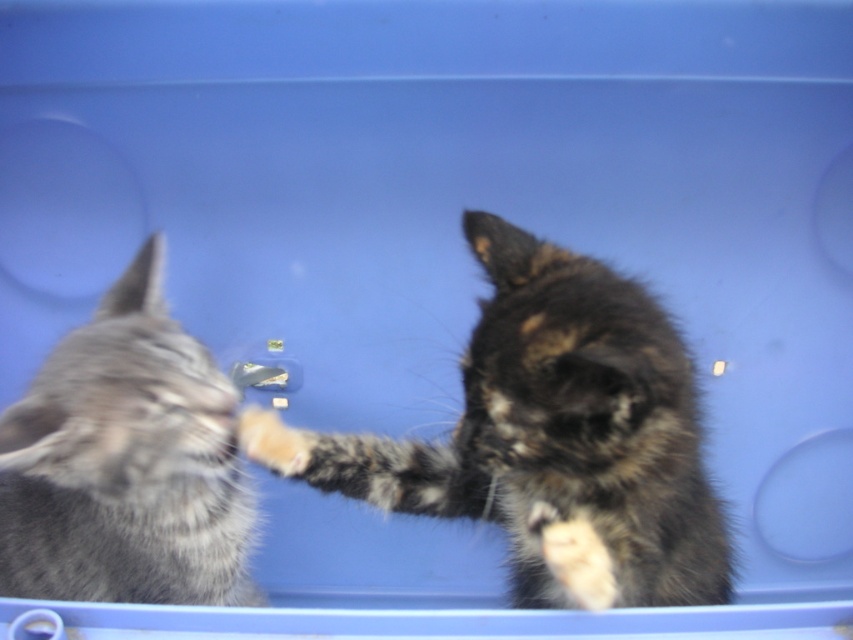
Can you confirm if tabby fur cat at center is positioned below gray fluffy cat at left?

Yes, tabby fur cat at center is below gray fluffy cat at left.

Who is higher up, tabby fur cat at center or gray fluffy cat at left?

gray fluffy cat at left is higher up.

Where is `tabby fur cat at center`? Image resolution: width=853 pixels, height=640 pixels. tabby fur cat at center is located at coordinates 550,438.